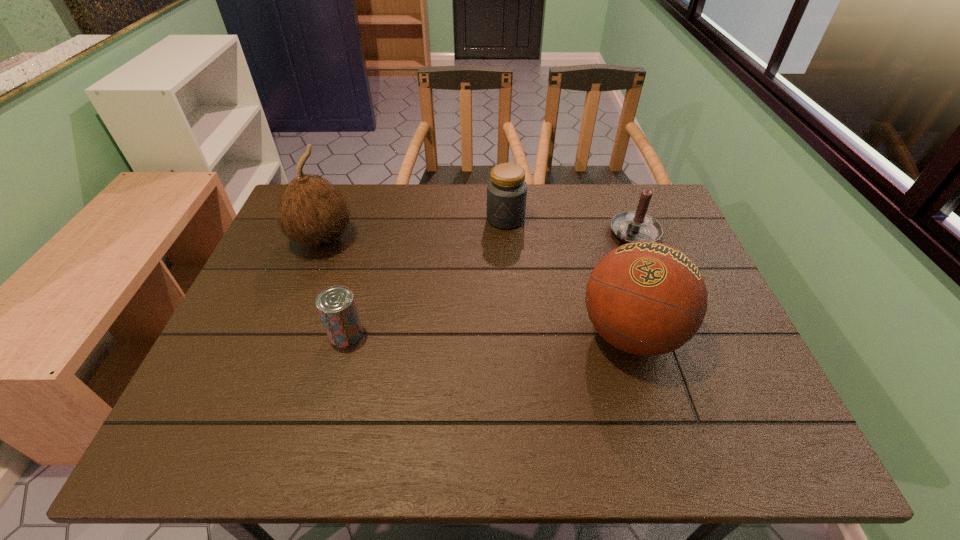
Locate an element on the screen. blank space at the right edge of the desktop is located at coordinates (708, 307).

I want to click on blank space at the far right corner of the desktop, so click(x=636, y=188).

Identify the location of vacant region at the near right corner. The image size is (960, 540). (709, 401).

You are a GUI agent. You are given a task and a screenshot of the screen. Output one action in this format:
    pyautogui.click(x=<x>, y=<y>)
    Task: Click on the vacant area that lies between the candle and the leftmost object
    Image resolution: width=960 pixels, height=540 pixels.
    Given the screenshot: What is the action you would take?
    [x=479, y=235]

I want to click on unoccupied position between the beer can and the basketball, so click(489, 334).

I want to click on vacant space that's between the shortest object and the jar, so [x=426, y=276].

Where is `blank region between the basketball and the second object from left to right`? The image size is (960, 540). blank region between the basketball and the second object from left to right is located at coordinates (489, 334).

At what (x,y) coordinates should I click in order to perform the action: click on free space that is in between the basketball and the shortest object. Please return your answer as a coordinate pair (x, y). Image resolution: width=960 pixels, height=540 pixels. Looking at the image, I should click on (489, 334).

Where is `free space between the candle and the beer can`? The height and width of the screenshot is (540, 960). free space between the candle and the beer can is located at coordinates (491, 284).

In order to click on vacant area that lies between the shortest object and the basketball in this screenshot , I will do `click(489, 334)`.